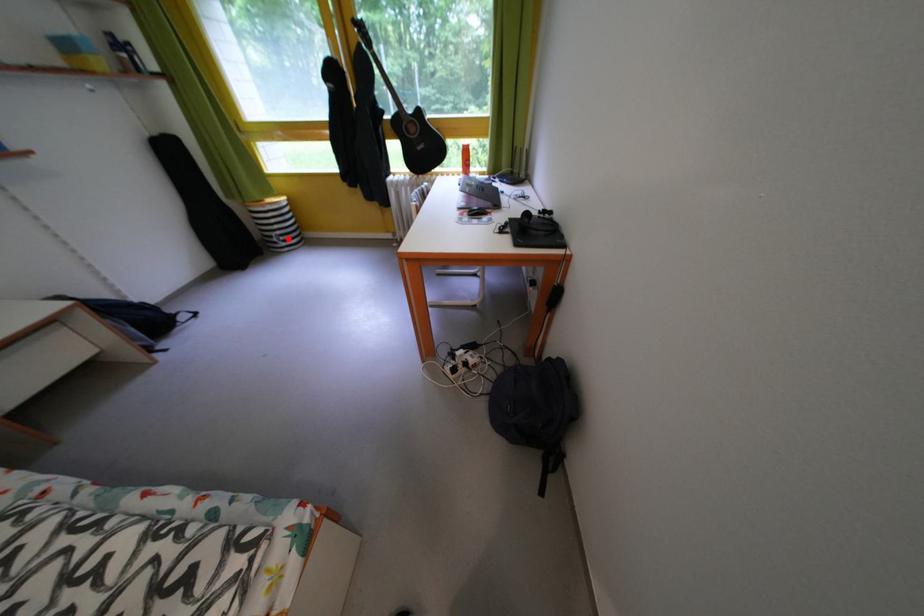
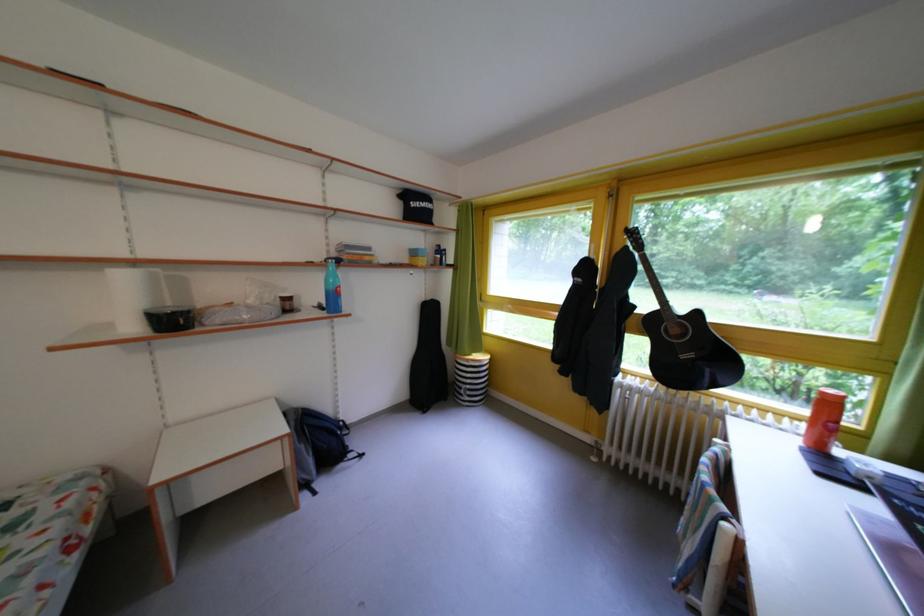
Question: I am providing you with two images of the same scene from different viewpoints. In image1, a red point is highlighted. Considering the same 3D point in image2, which of the following is correct?

Choices:
 (A) It is closer
 (B) It is farther

Answer: (B)